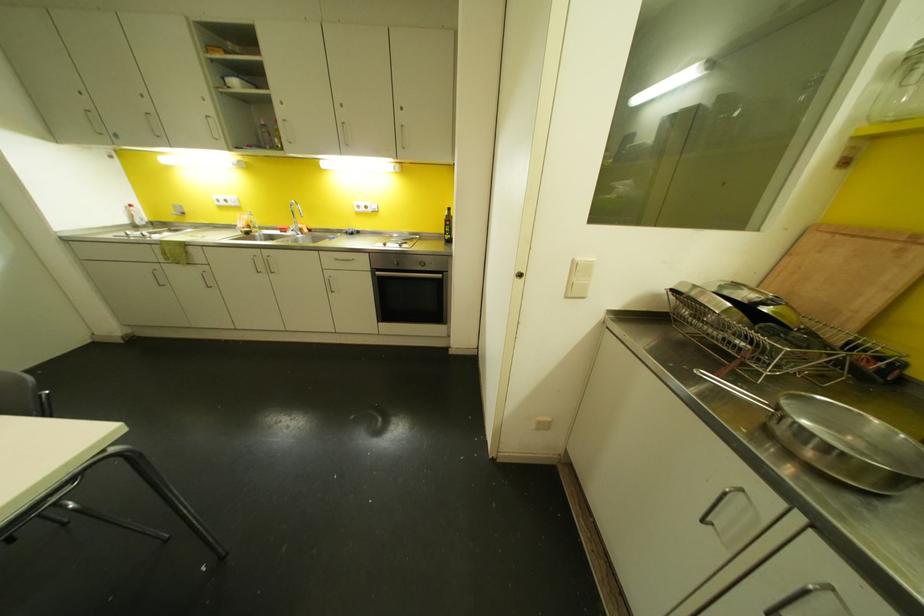
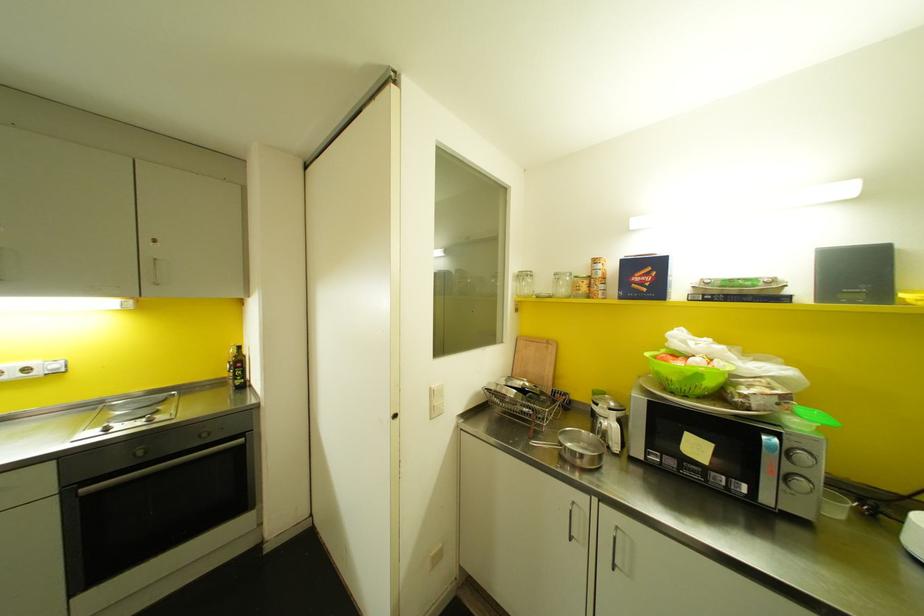
In the second image, find the point that corresponds to point (742, 490) in the first image.

(573, 501)